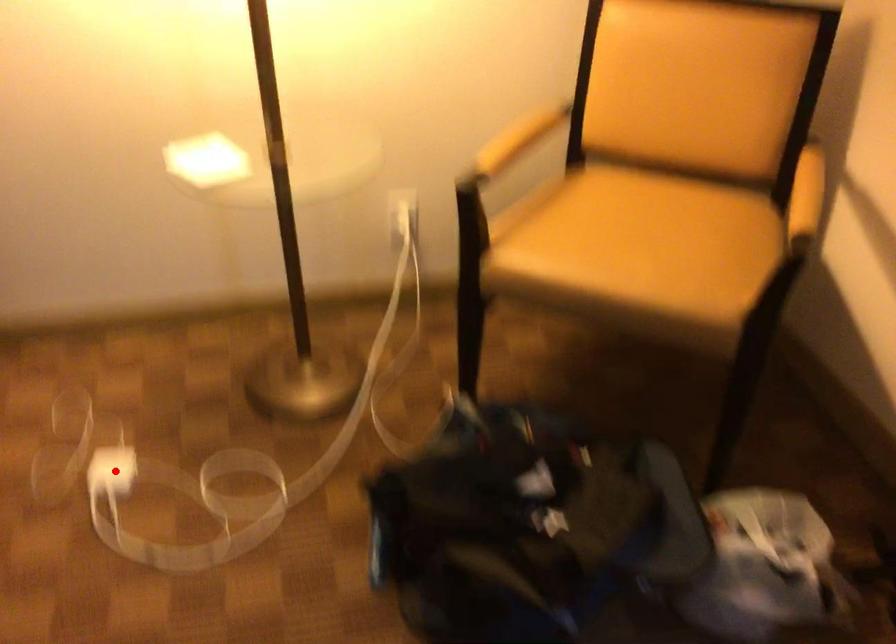
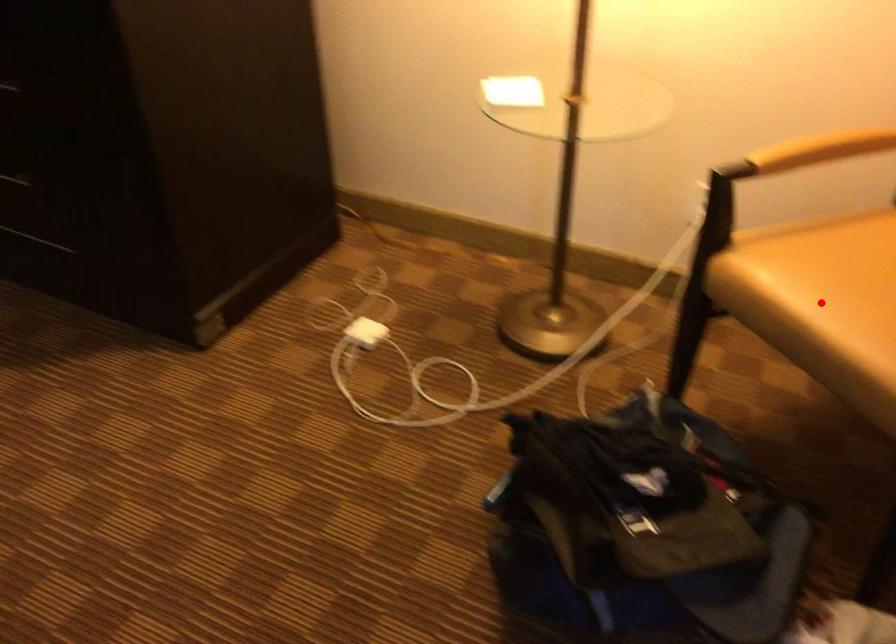
I am providing you with two images of the same scene from different viewpoints. A red point is marked on the first image and another point is marked on the second image. Does the point marked in image1 correspond to the same location as the one in image2?

No